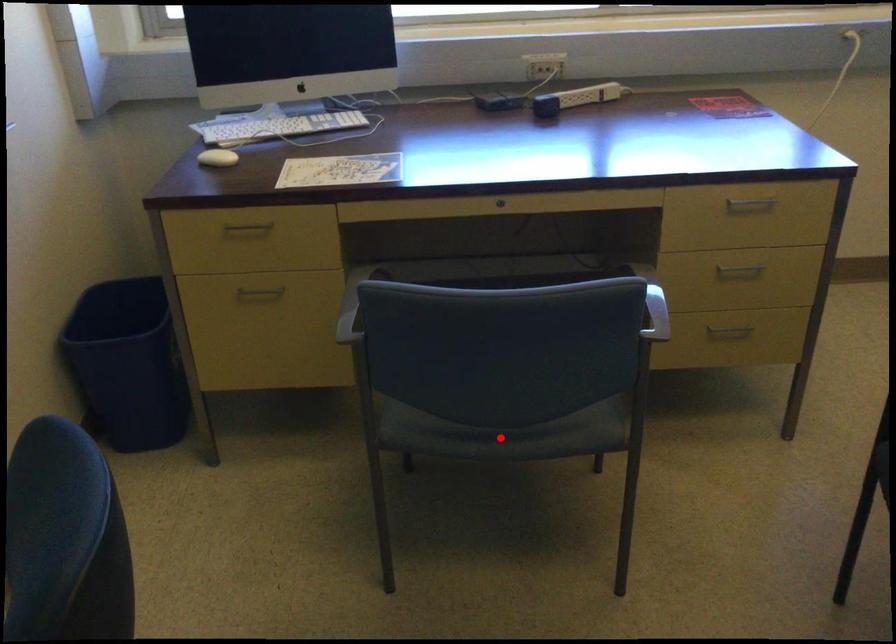
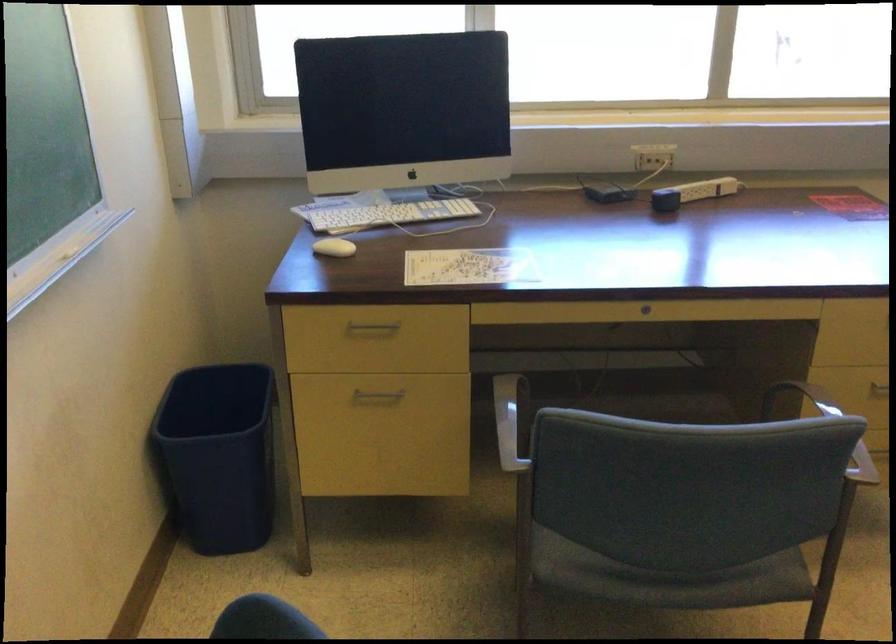
Question: I am providing you with two images of the same scene from different viewpoints. A red point is marked on the first image. Can you still see the location of the red point in image 2?

Choices:
 (A) Yes
 (B) No

Answer: (A)